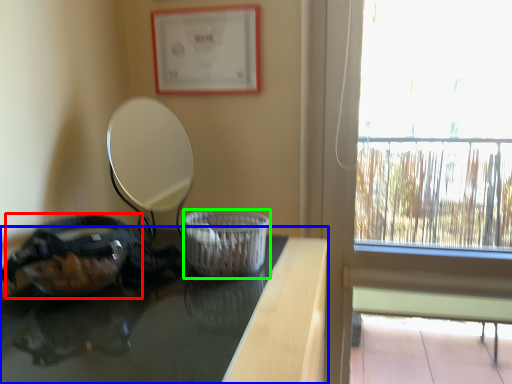
Question: Which is nearer to the glass bowl (highlighted by a red box)? table (highlighted by a blue box) or basket container (highlighted by a green box).

Choices:
 (A) table
 (B) basket container

Answer: (A)